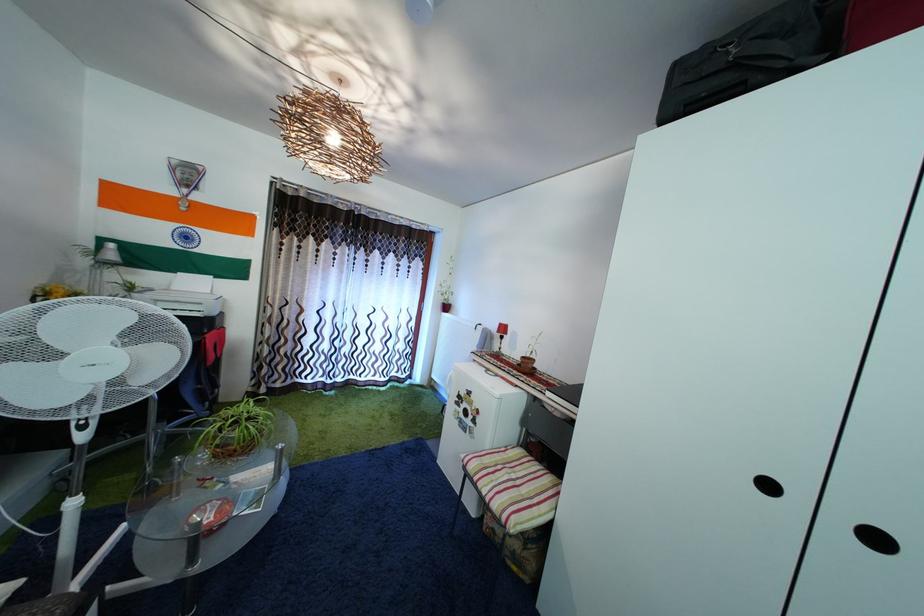
The height and width of the screenshot is (616, 924). I want to click on black bag handle, so pyautogui.click(x=745, y=53).